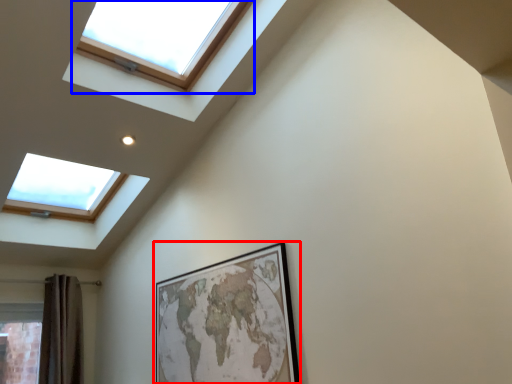
Question: Among these objects, which one is nearest to the camera, picture frame (highlighted by a red box) or window (highlighted by a blue box)?

Choices:
 (A) picture frame
 (B) window

Answer: (B)